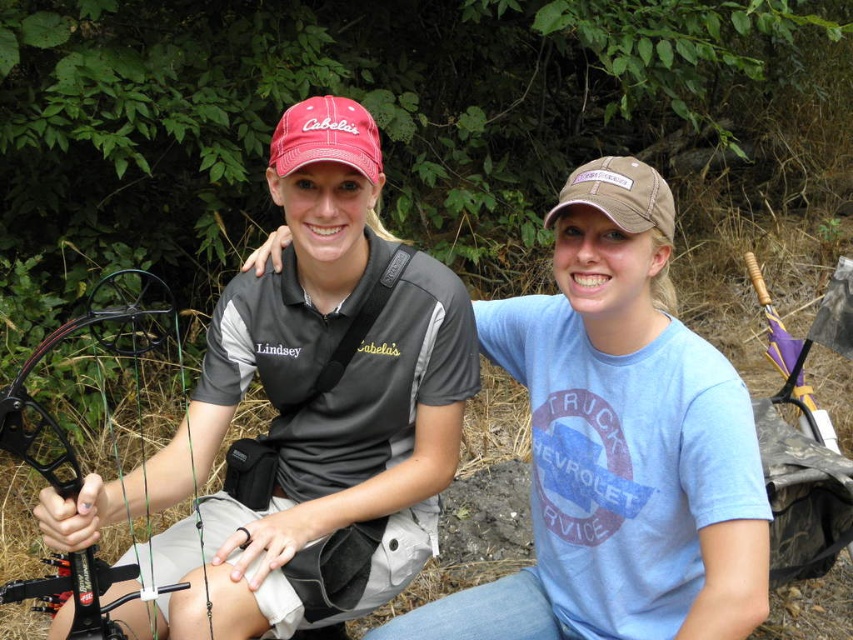
You are observing an archery range and notice two items in the scene. One is the matte gray shirt at center and the other is the black composite bow at left. Based on their positions, which item is located higher up?

The matte gray shirt at center is above the black composite bow at left, so it is located higher up.